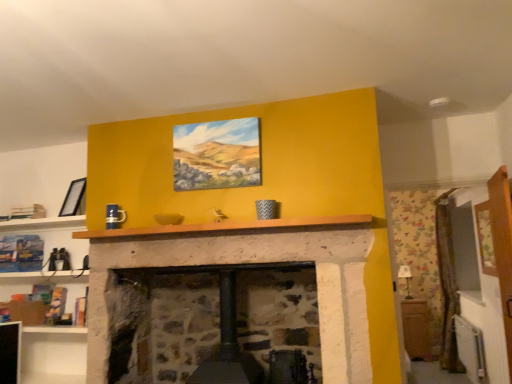
Question: From a real-world perspective, is matte black picture frame at upper left, which is the 1th picture frame in back-to-front order, physically below wooden mantle at center?

Choices:
 (A) yes
 (B) no

Answer: (B)

Question: Can you confirm if matte black picture frame at upper left, the 2th picture frame in the front-to-back sequence, is smaller than wooden mantle at center?

Choices:
 (A) no
 (B) yes

Answer: (B)

Question: Is matte black picture frame at upper left, acting as the second picture frame starting from the right, facing towards wooden mantle at center?

Choices:
 (A) yes
 (B) no

Answer: (B)

Question: Considering the relative sizes of matte black picture frame at upper left, marked as the 1th picture frame in a left-to-right arrangement, and wooden mantle at center in the image provided, is matte black picture frame at upper left, marked as the 1th picture frame in a left-to-right arrangement, wider than wooden mantle at center?

Choices:
 (A) no
 (B) yes

Answer: (A)

Question: Does matte black picture frame at upper left, acting as the second picture frame starting from the right, have a larger size compared to wooden mantle at center?

Choices:
 (A) no
 (B) yes

Answer: (A)

Question: Which is correct: matte black picture frame at upper left, the 2th picture frame in the front-to-back sequence, is inside wooden cabinet at right, or outside of it?

Choices:
 (A) inside
 (B) outside

Answer: (B)

Question: Based on their positions, is matte black picture frame at upper left, acting as the second picture frame starting from the right, located to the left or right of wooden cabinet at right?

Choices:
 (A) right
 (B) left

Answer: (B)

Question: Does point (83, 183) appear closer or farther from the camera than point (411, 329)?

Choices:
 (A) farther
 (B) closer

Answer: (A)

Question: Is matte black picture frame at upper left, the 2th picture frame in the front-to-back sequence, bigger or smaller than wooden cabinet at right?

Choices:
 (A) big
 (B) small

Answer: (B)

Question: From the image's perspective, is matte canvas painting at center, arranged as the second picture frame when viewed from the left, above or below matte black picture frame at upper left, marked as the 1th picture frame in a left-to-right arrangement?

Choices:
 (A) below
 (B) above

Answer: (B)

Question: Does point (234, 152) appear closer or farther from the camera than point (73, 190)?

Choices:
 (A) closer
 (B) farther

Answer: (A)

Question: Relative to matte black picture frame at upper left, acting as the second picture frame starting from the right, is matte canvas painting at center, the first picture frame viewed from the right, in front or behind?

Choices:
 (A) front
 (B) behind

Answer: (A)

Question: Based on their sizes in the image, would you say matte canvas painting at center, which is counted as the second picture frame, starting from the back, is bigger or smaller than matte black picture frame at upper left, which is the 1th picture frame in back-to-front order?

Choices:
 (A) small
 (B) big

Answer: (B)

Question: Does point (310, 216) appear closer or farther from the camera than point (74, 198)?

Choices:
 (A) farther
 (B) closer

Answer: (B)

Question: From the image's perspective, is wooden mantle at center positioned above or below matte black picture frame at upper left, marked as the 1th picture frame in a left-to-right arrangement?

Choices:
 (A) below
 (B) above

Answer: (A)